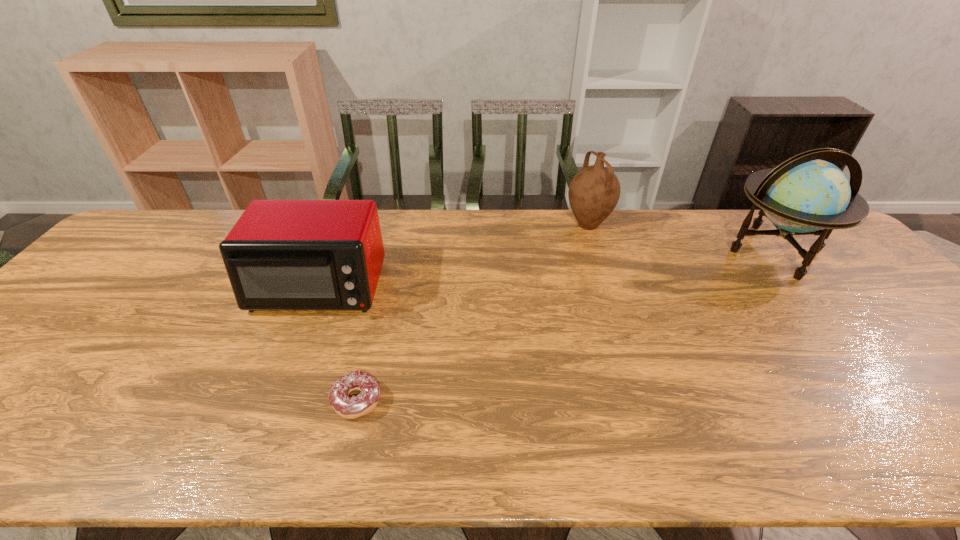
At what (x,y) coordinates should I click in order to perform the action: click on the tallest object. Please return your answer as a coordinate pair (x, y). The height and width of the screenshot is (540, 960). Looking at the image, I should click on (803, 195).

You are a GUI agent. You are given a task and a screenshot of the screen. Output one action in this format:
    pyautogui.click(x=<x>, y=<y>)
    Task: Click on the rightmost object
    This screenshot has height=540, width=960.
    Given the screenshot: What is the action you would take?
    pyautogui.click(x=803, y=195)

Identify the location of the second tallest object. The height and width of the screenshot is (540, 960). (594, 191).

The height and width of the screenshot is (540, 960). Identify the location of pitcher. (594, 191).

Locate an element on the screen. The height and width of the screenshot is (540, 960). the second shortest object is located at coordinates (281, 254).

The height and width of the screenshot is (540, 960). What are the coordinates of `the shortest object` in the screenshot? It's located at (347, 407).

I want to click on doughnut, so click(347, 407).

You are a GUI agent. You are given a task and a screenshot of the screen. Output one action in this format:
    pyautogui.click(x=<x>, y=<y>)
    Task: Click on the vacant space located 0.390m on the surface of the tallest object
    
    Given the screenshot: What is the action you would take?
    pyautogui.click(x=901, y=404)

At what (x,y) coordinates should I click in order to perform the action: click on free space located 0.130m on the right of the third object from left to right. Please return your answer as a coordinate pair (x, y). Looking at the image, I should click on (651, 225).

In order to click on blank space located on the front-facing side of the toaster oven in this screenshot , I will do `click(273, 399)`.